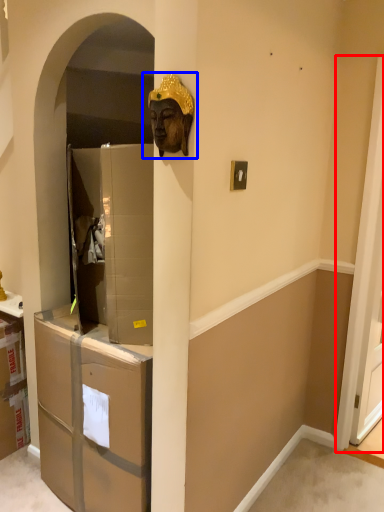
Question: Which of the following is the farthest to the observer, screen door (highlighted by a red box) or bronze statue (highlighted by a blue box)?

Choices:
 (A) screen door
 (B) bronze statue

Answer: (A)